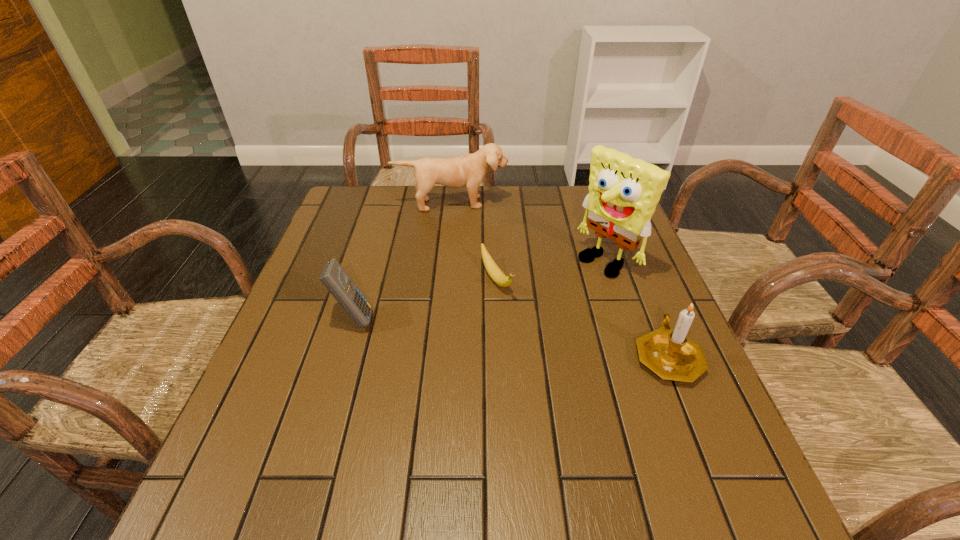
Where is `vacant space on the desktop that is between the calculator and the candle holder and is positioned on the face of the sponge`? Image resolution: width=960 pixels, height=540 pixels. vacant space on the desktop that is between the calculator and the candle holder and is positioned on the face of the sponge is located at coordinates (498, 335).

I want to click on vacant spot on the desktop that is between the calculator and the candle holder and is positioned on the left side of the puppy, so click(x=466, y=332).

Where is `vacant spot on the desktop that is between the calculator and the candle holder and is positioned at the stem of the banana`? Image resolution: width=960 pixels, height=540 pixels. vacant spot on the desktop that is between the calculator and the candle holder and is positioned at the stem of the banana is located at coordinates (541, 341).